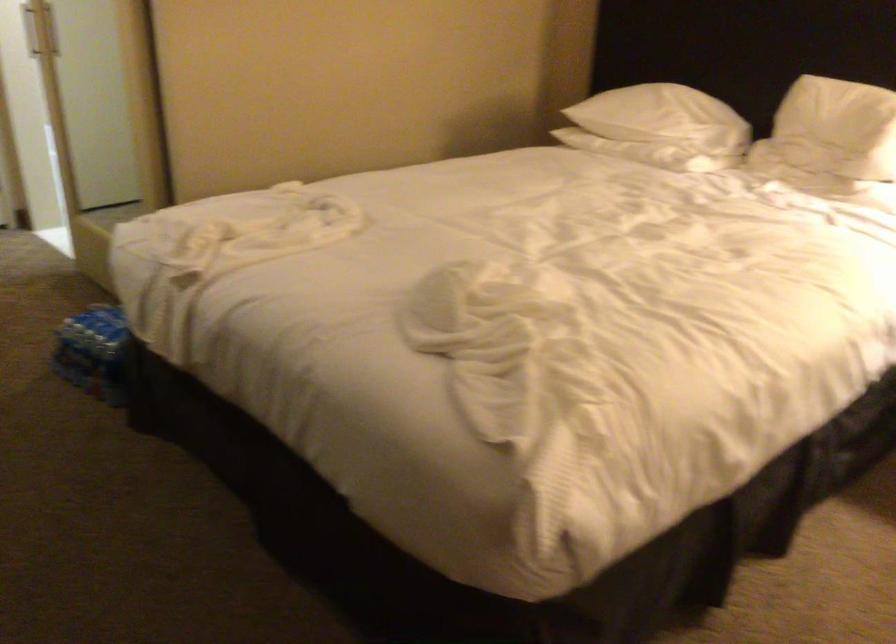
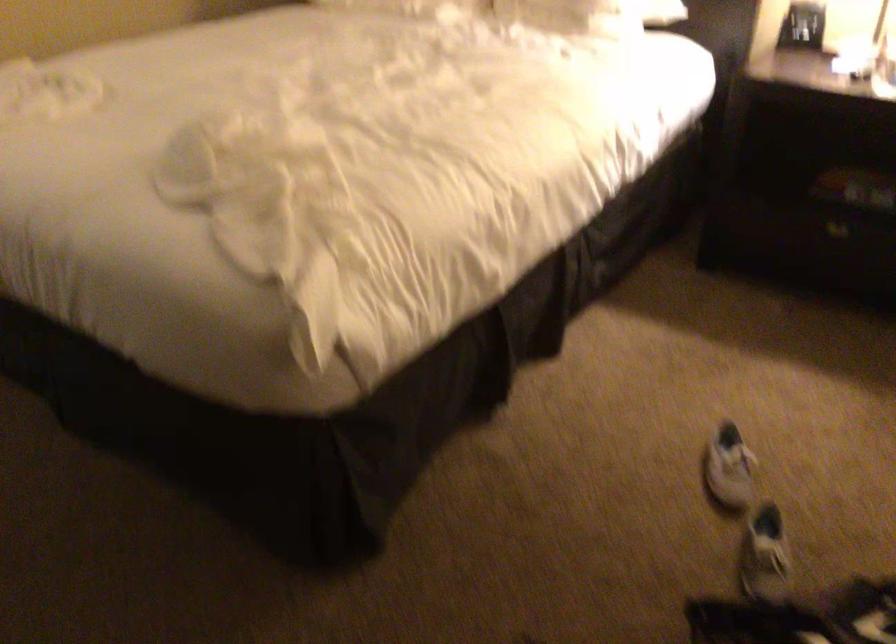
Which direction would the cameraman need to move to produce the second image?

The movement direction of the cameraman is right, backward.